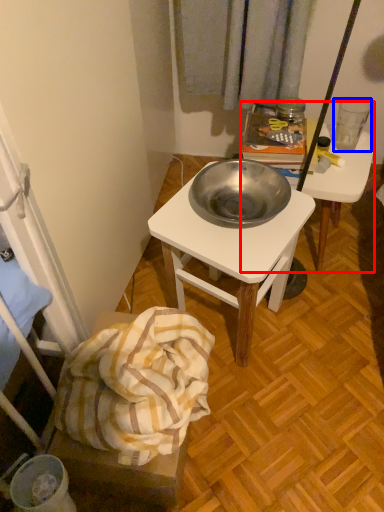
Question: Which point is further to the camera, desk (highlighted by a red box) or coffee cup (highlighted by a blue box)?

Choices:
 (A) desk
 (B) coffee cup

Answer: (B)